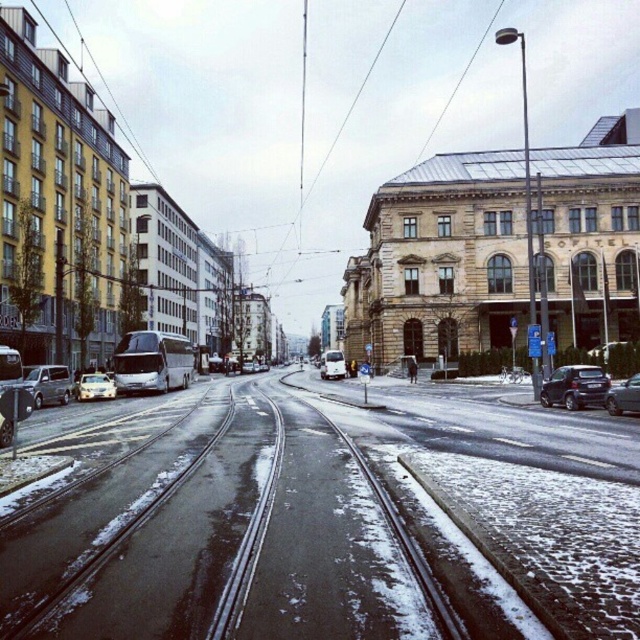
Between satin silver van at center-left and metallic silver sedan at lower right, which one is positioned lower?

satin silver van at center-left

Describe the element at coordinates (45, 384) in the screenshot. I see `satin silver van at center-left` at that location.

Which is behind, point (60, 388) or point (621, 404)?

Positioned behind is point (60, 388).

Locate an element on the screen. This screenshot has height=640, width=640. satin silver van at center-left is located at coordinates pyautogui.click(x=45, y=384).

Which of these two, metallic silver sedan at lower right or white matte van at center, stands taller?

white matte van at center

Is point (636, 388) positioned behind point (337, 376)?

No, (636, 388) is closer to viewer.

Identify the location of metallic silver sedan at lower right. This screenshot has width=640, height=640. [x=624, y=396].

Does satin silver van at center-left have a lesser height compared to white matte van at center?

Yes, satin silver van at center-left is shorter than white matte van at center.

Is satin silver van at center-left further to camera compared to white matte van at center?

No.

Measure the distance between point (54, 403) and camera.

Point (54, 403) and camera are 33.14 meters apart.

The image size is (640, 640). Identify the location of satin silver van at center-left. point(45,384).